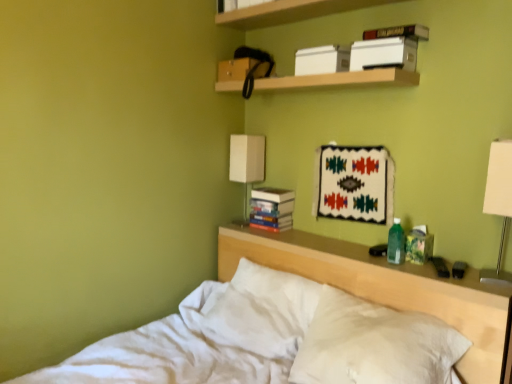
Describe the element at coordinates (398, 32) in the screenshot. The width and height of the screenshot is (512, 384). I see `hardcover book at upper center, which is the first paperback book in top-to-bottom order` at that location.

The width and height of the screenshot is (512, 384). In order to click on hardcover book at upper center, the 2th paperback book from the right in this screenshot , I will do `click(384, 54)`.

You are a GUI agent. You are given a task and a screenshot of the screen. Output one action in this format:
    pyautogui.click(x=<x>, y=<y>)
    Task: Click on the wooden shelf at upper center, which ranks as the second shelf in top-to-bottom order
    
    Given the screenshot: What is the action you would take?
    pyautogui.click(x=340, y=80)

The height and width of the screenshot is (384, 512). In order to click on white plastic lamp at right in this screenshot , I will do `click(499, 202)`.

This screenshot has width=512, height=384. What do you see at coordinates (383, 286) in the screenshot? I see `white cotton bed at center` at bounding box center [383, 286].

Locate an element on the screen. The width and height of the screenshot is (512, 384). white cotton bed at center is located at coordinates (383, 286).

What do you see at coordinates (374, 344) in the screenshot?
I see `white soft pillow at center` at bounding box center [374, 344].

What are the coordinates of `hardcover book at upper center, which is the first paperback book in top-to-bottom order` in the screenshot? It's located at (398, 32).

This screenshot has width=512, height=384. Identify the location of bed below the hardcover books at center, the third paperback book in the front-to-back sequence (from the image's perspective). (383, 286).

Do you think white cotton bed at center is within hardcover books at center, the first paperback book in the bottom-to-top sequence, or outside of it?

white cotton bed at center is located beyond the bounds of hardcover books at center, the first paperback book in the bottom-to-top sequence.

From a real-world perspective, which object stands above the other?

From a 3D spatial view, hardcover books at center, positioned as the 3th paperback book in top-to-bottom order, is above.

Which object is positioned more to the left, white cotton bed at center or hardcover books at center, which appears as the third paperback book when viewed from the right?

From the viewer's perspective, white cotton bed at center appears more on the left side.

Considering the relative sizes of wooden shelf at upper center, which appears as the first shelf when ordered from the bottom, and hardcover book at upper center, which is the 3th paperback book from left to right, in the image provided, is wooden shelf at upper center, which appears as the first shelf when ordered from the bottom, shorter than hardcover book at upper center, which is the 3th paperback book from left to right,?

No, wooden shelf at upper center, which appears as the first shelf when ordered from the bottom, is not shorter than hardcover book at upper center, which is the 3th paperback book from left to right.

From a real-world perspective, is wooden shelf at upper center, which appears as the first shelf when ordered from the bottom, located higher than hardcover book at upper center, marked as the third paperback book in a bottom-to-top arrangement?

No, from a real-world perspective, wooden shelf at upper center, which appears as the first shelf when ordered from the bottom, is not above hardcover book at upper center, marked as the third paperback book in a bottom-to-top arrangement.

Is wooden shelf at upper center, which ranks as the second shelf in top-to-bottom order, located outside hardcover book at upper center, which is the 3th paperback book from left to right?

wooden shelf at upper center, which ranks as the second shelf in top-to-bottom order, is positioned outside hardcover book at upper center, which is the 3th paperback book from left to right.

Between hardcover book at upper center, marked as the first paperback book in a right-to-left arrangement, and white matte lampshade at upper center, which one appears on the left side from the viewer's perspective?

white matte lampshade at upper center is more to the left.

Consider the image. From a real-world perspective, is hardcover book at upper center, marked as the third paperback book in a bottom-to-top arrangement, physically above white matte lampshade at upper center?

Yes, from a real-world perspective, hardcover book at upper center, marked as the third paperback book in a bottom-to-top arrangement, is above white matte lampshade at upper center.

Would you consider hardcover book at upper center, acting as the second paperback book starting from the front, to be distant from white matte lampshade at upper center?

No, hardcover book at upper center, acting as the second paperback book starting from the front, is in close proximity to white matte lampshade at upper center.

Would you say hardcover book at upper center, which is the 3th paperback book from left to right, is inside or outside white matte lampshade at upper center?

The correct answer is: outside.

Based on their positions, is hardcover book at upper center, which is the 3th paperback book from left to right, located to the left or right of wooden shelf at upper center, which appears as the first shelf when ordered from the bottom?

From the image, it's evident that hardcover book at upper center, which is the 3th paperback book from left to right, is to the right of wooden shelf at upper center, which appears as the first shelf when ordered from the bottom.

Is hardcover book at upper center, which is the 3th paperback book from left to right, not within wooden shelf at upper center, which appears as the first shelf when ordered from the bottom?

Absolutely, hardcover book at upper center, which is the 3th paperback book from left to right, is external to wooden shelf at upper center, which appears as the first shelf when ordered from the bottom.

Consider the image. From the image's perspective, relative to wooden shelf at upper center, which ranks as the second shelf in top-to-bottom order, is hardcover book at upper center, positioned as the 2th paperback book in back-to-front order, above or below?

hardcover book at upper center, positioned as the 2th paperback book in back-to-front order, is above wooden shelf at upper center, which ranks as the second shelf in top-to-bottom order.

How distant is hardcover book at upper center, which is the first paperback book in top-to-bottom order, from wooden shelf at upper center, which appears as the first shelf when ordered from the bottom?

A distance of 11.60 inches exists between hardcover book at upper center, which is the first paperback book in top-to-bottom order, and wooden shelf at upper center, which appears as the first shelf when ordered from the bottom.

Which object is more forward, white soft pillow at center or wooden shelf at upper center, which ranks as the second shelf in top-to-bottom order?

white soft pillow at center is more forward.

From the image's perspective, does white soft pillow at center appear higher than wooden shelf at upper center, which ranks as the second shelf in top-to-bottom order?

No, from the image's perspective, white soft pillow at center is not above wooden shelf at upper center, which ranks as the second shelf in top-to-bottom order.

Is white soft pillow at center at the left side of wooden shelf at upper center, which appears as the first shelf when ordered from the bottom?

No.

This screenshot has height=384, width=512. Identify the location of pillow located below the wooden shelf at upper center, which ranks as the second shelf in top-to-bottom order (from the image's perspective). (374, 344).

In the scene shown: Is white soft pillow at center aimed at wooden shelf at upper center, which is the 2th shelf from bottom to top?

No, white soft pillow at center is not oriented towards wooden shelf at upper center, which is the 2th shelf from bottom to top.

From their relative heights in the image, would you say white soft pillow at center is taller or shorter than wooden shelf at upper center, which is the 2th shelf from bottom to top?

Clearly, white soft pillow at center is taller compared to wooden shelf at upper center, which is the 2th shelf from bottom to top.

Is white soft pillow at center surrounding wooden shelf at upper center, the first shelf when ordered from top to bottom?

No, wooden shelf at upper center, the first shelf when ordered from top to bottom, is located outside of white soft pillow at center.

Which object is closer to the camera taking this photo, white soft pillow at center or wooden shelf at upper center, which is the 2th shelf from bottom to top?

white soft pillow at center is in front.

Is wooden shelf at upper center, the first shelf when ordered from top to bottom, closer to the viewer compared to white matte lampshade at upper center?

Yes, wooden shelf at upper center, the first shelf when ordered from top to bottom, is in front of white matte lampshade at upper center.

Consider the image. From the image's perspective, which one is positioned higher, wooden shelf at upper center, the first shelf when ordered from top to bottom, or white matte lampshade at upper center?

From the image's view, wooden shelf at upper center, the first shelf when ordered from top to bottom, is above.

Measure the distance from wooden shelf at upper center, the first shelf when ordered from top to bottom, to white matte lampshade at upper center.

wooden shelf at upper center, the first shelf when ordered from top to bottom, is 77.96 centimeters from white matte lampshade at upper center.

Which paperback book is the 3rd one when counting from the back of the white cotton bed at center? Please provide its 2D coordinates.

[(271, 208)]

You are a GUI agent. You are given a task and a screenshot of the screen. Output one action in this format:
    pyautogui.click(x=<x>, y=<y>)
    Task: Click on the paperback book that is the 2nd one when counting rightward from the wooden shelf at upper center, which appears as the first shelf when ordered from the bottom
    The image size is (512, 384).
    Given the screenshot: What is the action you would take?
    pyautogui.click(x=398, y=32)

Which object lies nearer to the anchor point white matte lampshade at upper center, hardcover book at upper center, which is the 3th paperback book from left to right, or white plastic lamp at right?

Among the two, hardcover book at upper center, which is the 3th paperback book from left to right, is located nearer to white matte lampshade at upper center.

Looking at the image, which one is located closer to hardcover book at upper center, acting as the second paperback book starting from the front, white plastic lamp at right or white matte lampshade at upper center?

white plastic lamp at right.

Based on their spatial positions, is hardcover book at upper center, positioned as the second paperback book in left-to-right order, or wooden shelf at upper center, which ranks as the second shelf in top-to-bottom order, further from white cotton bed at center?

hardcover book at upper center, positioned as the second paperback book in left-to-right order, is positioned further to the anchor white cotton bed at center.

Estimate the real-world distances between objects in this image. Which object is further from hardcover books at center, which appears as the third paperback book when viewed from the right, white soft pillow at center or hardcover book at upper center, which is the first paperback book in top-to-bottom order?

Among the two, hardcover book at upper center, which is the first paperback book in top-to-bottom order, is located further to hardcover books at center, which appears as the third paperback book when viewed from the right.

Based on their spatial positions, is hardcover books at center, the third paperback book in the front-to-back sequence, or wooden shelf at upper center, which appears as the first shelf when ordered from the bottom, further from white cotton bed at center?

wooden shelf at upper center, which appears as the first shelf when ordered from the bottom.

Estimate the real-world distances between objects in this image. Which object is further from white matte lampshade at upper center, white soft pillow at center or white plastic lamp at right?

white plastic lamp at right is further to white matte lampshade at upper center.

Which object lies nearer to the anchor point wooden shelf at upper center, the first shelf when ordered from top to bottom, hardcover books at center, positioned as the 3th paperback book in top-to-bottom order, or white soft pillow at center?

hardcover books at center, positioned as the 3th paperback book in top-to-bottom order, is positioned closer to the anchor wooden shelf at upper center, the first shelf when ordered from top to bottom.

Based on their spatial positions, is white soft pillow at center or white plastic lamp at right further from hardcover book at upper center, which is the first paperback book in top-to-bottom order?

Among the two, white soft pillow at center is located further to hardcover book at upper center, which is the first paperback book in top-to-bottom order.

Locate an element on the screen. bedside lamp between hardcover book at upper center, marked as the first paperback book in a right-to-left arrangement, and white soft pillow at center from top to bottom is located at coordinates (499, 202).

The image size is (512, 384). Find the location of `shelf between hardcover book at upper center, marked as the first paperback book in a right-to-left arrangement, and hardcover books at center, the third paperback book in the front-to-back sequence, vertically`. shelf between hardcover book at upper center, marked as the first paperback book in a right-to-left arrangement, and hardcover books at center, the third paperback book in the front-to-back sequence, vertically is located at coordinates (340, 80).

Locate an element on the screen. The image size is (512, 384). bedside lamp between white soft pillow at center and hardcover books at center, the 1th paperback book positioned from the back, from front to back is located at coordinates (499, 202).

Identify the location of shelf between wooden shelf at upper center, the first shelf when ordered from top to bottom, and hardcover book at upper center, positioned as the 2th paperback book in back-to-front order, in the horizontal direction. (340, 80).